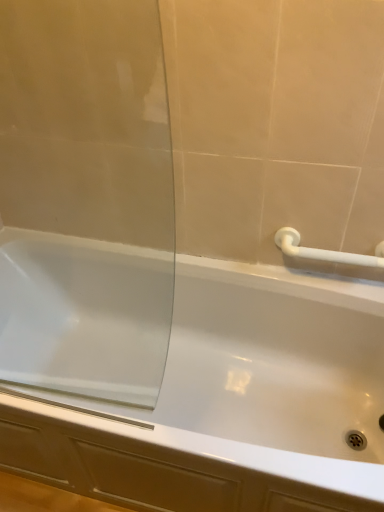
Question: Choose the correct answer: Is transparent glass screen door at left inside white plastic towel bar at upper right or outside it?

Choices:
 (A) inside
 (B) outside

Answer: (B)

Question: From the image's perspective, is transparent glass screen door at left located above or below white plastic towel bar at upper right?

Choices:
 (A) below
 (B) above

Answer: (A)

Question: Which is nearer to the white plastic towel bar at upper right?

Choices:
 (A) white glossy bathtub at center
 (B) transparent glass screen door at left

Answer: (A)

Question: Based on their relative distances, which object is nearer to the transparent glass screen door at left?

Choices:
 (A) white glossy bathtub at center
 (B) white plastic towel bar at upper right

Answer: (A)